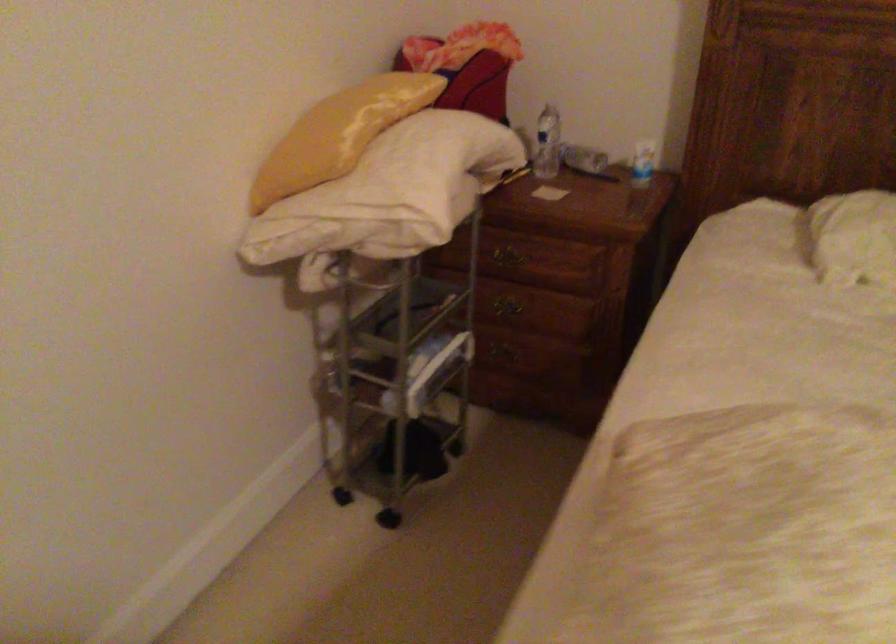
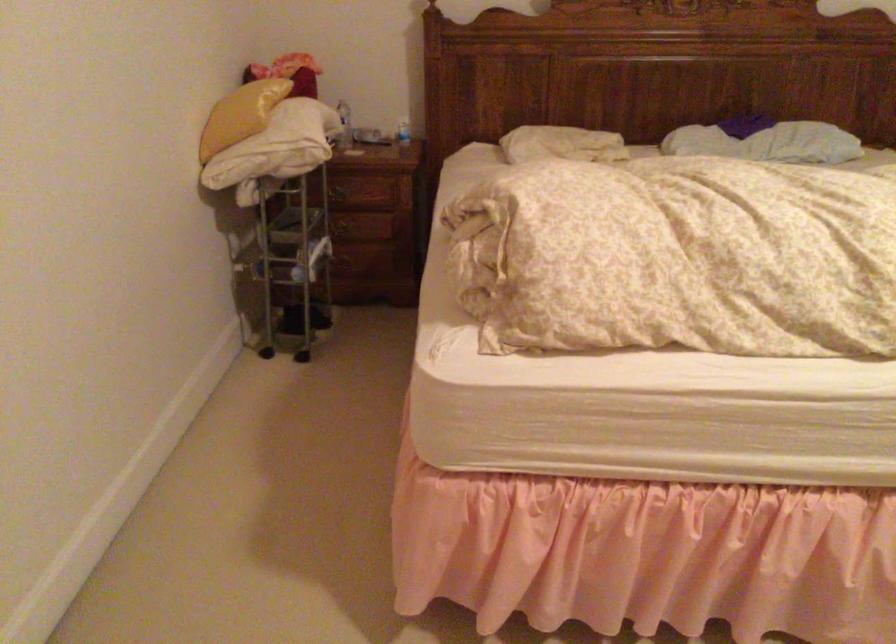
Find the pixel in the second image that matches the point at 502,259 in the first image.

(338, 194)